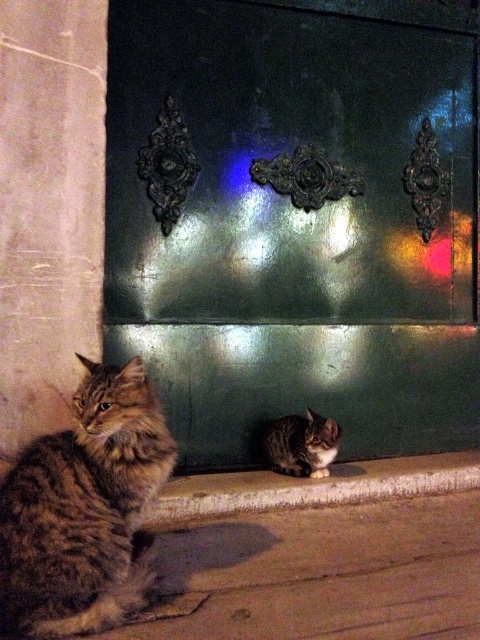
Question: Is tabby fur cat at left wider than smooth concrete ledge at lower center?

Choices:
 (A) yes
 (B) no

Answer: (B)

Question: Which point is closer to the camera?

Choices:
 (A) 19,630
 (B) 285,444

Answer: (A)

Question: Is tabby fur cat at left to the right of smooth concrete ledge at lower center from the viewer's perspective?

Choices:
 (A) no
 (B) yes

Answer: (A)

Question: Estimate the real-world distances between objects in this image. Which object is closer to the tabby fur cat at lower center?

Choices:
 (A) smooth concrete ledge at lower center
 (B) tabby fur cat at left

Answer: (A)

Question: Does tabby fur cat at left have a lesser width compared to tabby fur cat at lower center?

Choices:
 (A) yes
 (B) no

Answer: (B)

Question: Among these objects, which one is farthest from the camera?

Choices:
 (A) tabby fur cat at lower center
 (B) smooth concrete ledge at lower center
 (C) tabby fur cat at left

Answer: (A)